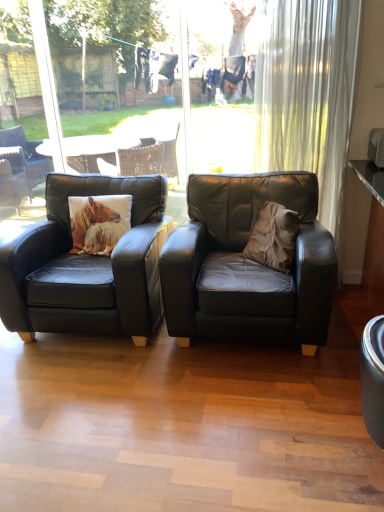
Question: Is transparent glass window at center in contact with black leather chair at center, placed as the first chair when sorted from left to right?

Choices:
 (A) yes
 (B) no

Answer: (B)

Question: Is transparent glass window at center positioned behind black leather chair at center, which appears as the second chair when viewed from the right?

Choices:
 (A) no
 (B) yes

Answer: (B)

Question: Can you confirm if transparent glass window at center is shorter than black leather chair at center, placed as the first chair when sorted from left to right?

Choices:
 (A) yes
 (B) no

Answer: (B)

Question: Does transparent glass window at center have a smaller size compared to black leather chair at center, which appears as the second chair when viewed from the right?

Choices:
 (A) yes
 (B) no

Answer: (A)

Question: Is transparent glass window at center facing away from black leather chair at center, which appears as the second chair when viewed from the right?

Choices:
 (A) yes
 (B) no

Answer: (B)

Question: Is point (269, 264) closer or farther from the camera than point (284, 24)?

Choices:
 (A) farther
 (B) closer

Answer: (B)

Question: In terms of size, does brown suede throw pillow at center appear bigger or smaller than white sheer curtain at upper right?

Choices:
 (A) big
 (B) small

Answer: (B)

Question: In the image, is brown suede throw pillow at center positioned in front of or behind white sheer curtain at upper right?

Choices:
 (A) front
 (B) behind

Answer: (A)

Question: From the image's perspective, is brown suede throw pillow at center above or below white sheer curtain at upper right?

Choices:
 (A) below
 (B) above

Answer: (A)

Question: From the image's perspective, is black leather chair at center, which appears as the second chair when viewed from the right, located above or below matte black armchair at center, the second chair when ordered from left to right?

Choices:
 (A) below
 (B) above

Answer: (B)

Question: Relative to matte black armchair at center, the second chair when ordered from left to right, is black leather chair at center, placed as the first chair when sorted from left to right, in front or behind?

Choices:
 (A) behind
 (B) front

Answer: (A)

Question: In the image, is black leather chair at center, which appears as the second chair when viewed from the right, on the left side or the right side of matte black armchair at center, the first chair viewed from the right?

Choices:
 (A) right
 (B) left

Answer: (B)

Question: Considering the positions of black leather chair at center, placed as the first chair when sorted from left to right, and matte black armchair at center, the second chair when ordered from left to right, in the image, is black leather chair at center, placed as the first chair when sorted from left to right, wider or thinner than matte black armchair at center, the second chair when ordered from left to right,?

Choices:
 (A) wide
 (B) thin

Answer: (A)

Question: Considering their positions, is transparent glass window at center located in front of or behind white sheer curtain at upper right?

Choices:
 (A) front
 (B) behind

Answer: (B)

Question: Is transparent glass window at center taller or shorter than white sheer curtain at upper right?

Choices:
 (A) short
 (B) tall

Answer: (B)